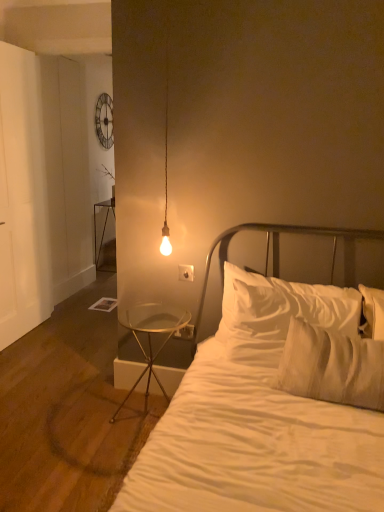
Question: From a real-world perspective, is white plastic electric outlet at lower center, which ranks as the 1th electric outlet in back-to-front order, above or below metallic glass table at left, the 1th nightstand from the back?

Choices:
 (A) above
 (B) below

Answer: (A)

Question: Choose the correct answer: Is white plastic electric outlet at lower center, placed as the second electric outlet when sorted from front to back, inside metallic glass table at left, placed as the 2th nightstand when sorted from bottom to top, or outside it?

Choices:
 (A) outside
 (B) inside

Answer: (A)

Question: Which of these objects is positioned farthest from the metallic glass table at left, the second nightstand when ordered from front to back?

Choices:
 (A) white plastic electric outlet at center, which is the second electric outlet from back to front
 (B) white plastic electric outlet at lower center, placed as the second electric outlet when sorted from front to back
 (C) clear glass table at lower left, positioned as the 1th nightstand in right-to-left order
 (D) white soft pillow at center
 (E) white cotton bed at center

Answer: (E)

Question: Which of these objects is positioned farthest from the white cotton bed at center?

Choices:
 (A) white plastic electric outlet at center, which is the second electric outlet from bottom to top
 (B) white soft pillow at center
 (C) white plastic electric outlet at lower center, placed as the second electric outlet when sorted from front to back
 (D) metallic glass table at left, placed as the 1th nightstand when sorted from top to bottom
 (E) clear glass table at lower left, the 2th nightstand from the top

Answer: (D)